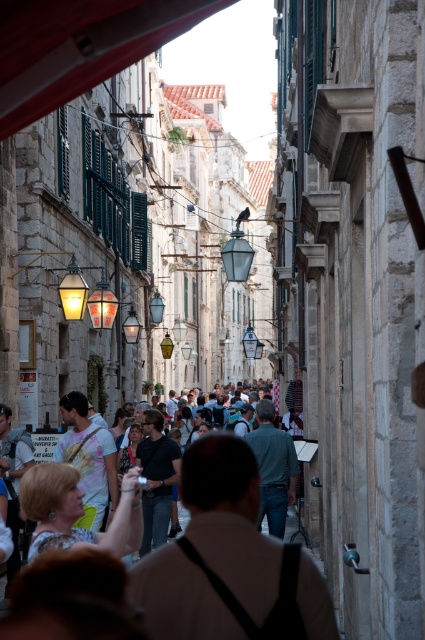
Question: Which of the following is the farthest from the observer?

Choices:
 (A) (181, 602)
 (B) (149, 532)

Answer: (B)

Question: Is dark gray fabric at center above light beige fabric purse at center?

Choices:
 (A) no
 (B) yes

Answer: (B)

Question: Which point is closer to the camera?

Choices:
 (A) dark gray shirt at center
 (B) light beige fabric purse at center
 (C) dark gray fabric at center

Answer: (C)

Question: Does dark gray fabric at center have a greater width compared to light beige fabric purse at center?

Choices:
 (A) yes
 (B) no

Answer: (A)

Question: Which of the following is the closest to the observer?

Choices:
 (A) dark gray shirt at center
 (B) light beige fabric purse at center
 (C) dark gray fabric at center

Answer: (C)

Question: Is dark gray fabric at center smaller than light beige fabric purse at center?

Choices:
 (A) yes
 (B) no

Answer: (A)